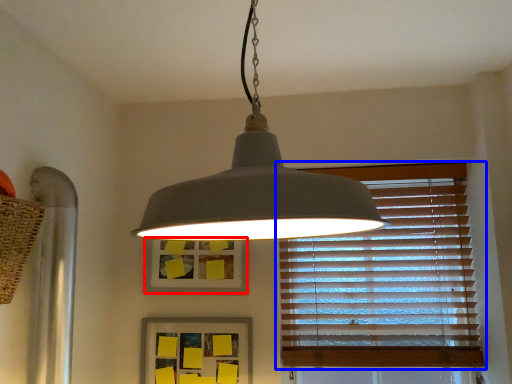
Question: Among these objects, which one is nearest to the camera, picture frame (highlighted by a red box) or window blind (highlighted by a blue box)?

Choices:
 (A) picture frame
 (B) window blind

Answer: (B)